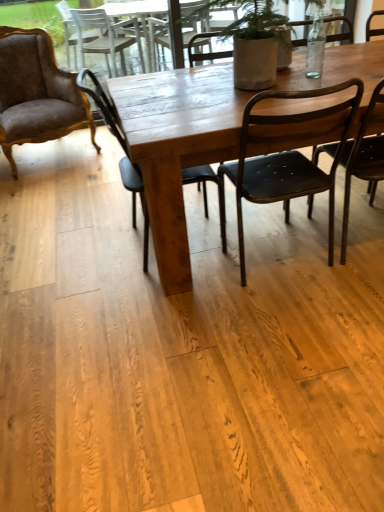
You are a GUI agent. You are given a task and a screenshot of the screen. Output one action in this format:
    pyautogui.click(x=<x>, y=<y>)
    Task: Click on the black metal chair at right, arranged as the fourth chair when viewed from the left
    
    Given the screenshot: What is the action you would take?
    pyautogui.click(x=364, y=157)

This screenshot has width=384, height=512. Describe the element at coordinates (177, 146) in the screenshot. I see `wooden table at center` at that location.

Locate an element on the screen. velvet brown armchair at left, arranged as the 4th chair when viewed from the right is located at coordinates (37, 93).

Measure the distance between point (266, 202) and camera.

They are 5.99 feet apart.

Where is `matte black chair at center, positioned as the 2th chair in left-to-right order`? This screenshot has width=384, height=512. matte black chair at center, positioned as the 2th chair in left-to-right order is located at coordinates (123, 150).

Locate an element on the screen. This screenshot has width=384, height=512. black metal chair at right, which is counted as the 1th chair, starting from the right is located at coordinates (364, 157).

In order to click on chair above the black metal chair at center, the third chair in the left-to-right sequence (from a real-world perspective) in this screenshot , I will do `click(364, 157)`.

Which of these two, black metal chair at right, arranged as the fourth chair when viewed from the left, or black metal chair at center, which is the second chair in right-to-left order, is smaller?

black metal chair at right, arranged as the fourth chair when viewed from the left.

Is black metal chair at right, which is counted as the 1th chair, starting from the right, with black metal chair at center, which is the second chair in right-to-left order?

They are not placed beside each other.

Is black metal chair at center, which is the second chair in right-to-left order, inside black metal chair at right, which is counted as the 1th chair, starting from the right?

No, black metal chair at center, which is the second chair in right-to-left order, is not inside black metal chair at right, which is counted as the 1th chair, starting from the right.

At what (x,y) coordinates should I click in order to perform the action: click on kitchen & dining room table lying on the right of velvet brown armchair at left, arranged as the 4th chair when viewed from the right. Please return your answer as a coordinate pair (x, y). Looking at the image, I should click on (177, 146).

Measure the distance from wooden table at center to velvet brown armchair at left, placed as the 1th chair when sorted from left to right.

A distance of 1.44 meters exists between wooden table at center and velvet brown armchair at left, placed as the 1th chair when sorted from left to right.

From the image's perspective, is wooden table at center located above or below velvet brown armchair at left, arranged as the 4th chair when viewed from the right?

wooden table at center is below velvet brown armchair at left, arranged as the 4th chair when viewed from the right.

Which is more to the right, wooden table at center or velvet brown armchair at left, placed as the 1th chair when sorted from left to right?

From the viewer's perspective, wooden table at center appears more on the right side.

Considering the relative sizes of black metal chair at center, which is the second chair in right-to-left order, and velvet brown armchair at left, placed as the 1th chair when sorted from left to right, in the image provided, is black metal chair at center, which is the second chair in right-to-left order, wider than velvet brown armchair at left, placed as the 1th chair when sorted from left to right,?

No.

Does black metal chair at center, which is the second chair in right-to-left order, contain velvet brown armchair at left, placed as the 1th chair when sorted from left to right?

No, black metal chair at center, which is the second chair in right-to-left order, does not contain velvet brown armchair at left, placed as the 1th chair when sorted from left to right.

Consider the image. Considering the positions of objects black metal chair at center, the third chair in the left-to-right sequence, and velvet brown armchair at left, placed as the 1th chair when sorted from left to right, in the image provided, who is more to the right, black metal chair at center, the third chair in the left-to-right sequence, or velvet brown armchair at left, placed as the 1th chair when sorted from left to right,?

Positioned to the right is black metal chair at center, the third chair in the left-to-right sequence.

Is black metal chair at center, which is the second chair in right-to-left order, oriented away from velvet brown armchair at left, placed as the 1th chair when sorted from left to right?

black metal chair at center, which is the second chair in right-to-left order, does not have its back to velvet brown armchair at left, placed as the 1th chair when sorted from left to right.

Between wooden table at center and black metal chair at center, which is the second chair in right-to-left order, which one appears on the left side from the viewer's perspective?

black metal chair at center, which is the second chair in right-to-left order, is more to the left.

Which of these two, wooden table at center or black metal chair at center, the third chair in the left-to-right sequence, stands taller?

With more height is black metal chair at center, the third chair in the left-to-right sequence.

Is wooden table at center thinner than black metal chair at center, the third chair in the left-to-right sequence?

Incorrect, the width of wooden table at center is not less than that of black metal chair at center, the third chair in the left-to-right sequence.

Is wooden table at center in front of black metal chair at center, which is the second chair in right-to-left order?

No, it is not.

Who is shorter, wooden table at center or matte black chair at center, positioned as the 2th chair in left-to-right order?

With less height is wooden table at center.

From the image's perspective, which one is positioned higher, wooden table at center or matte black chair at center, positioned as the 2th chair in left-to-right order?

wooden table at center appears higher in the image.

Looking at this image, based on their sizes in the image, would you say wooden table at center is bigger or smaller than matte black chair at center, positioned as the 2th chair in left-to-right order?

wooden table at center is bigger than matte black chair at center, positioned as the 2th chair in left-to-right order.

Which is farther from the camera, (151, 181) or (117, 116)?

Positioned behind is point (151, 181).

From a real-world perspective, is black metal chair at right, which is counted as the 1th chair, starting from the right, over velvet brown armchair at left, placed as the 1th chair when sorted from left to right?

Correct, in the physical world, black metal chair at right, which is counted as the 1th chair, starting from the right, is higher than velvet brown armchair at left, placed as the 1th chair when sorted from left to right.

Is black metal chair at right, arranged as the fourth chair when viewed from the left, behind velvet brown armchair at left, arranged as the 4th chair when viewed from the right?

No, it is in front of velvet brown armchair at left, arranged as the 4th chair when viewed from the right.

Which point is more distant from viewer, (378, 150) or (20, 101)?

The point (20, 101) is farther from the camera.

Which object is thinner, black metal chair at right, arranged as the fourth chair when viewed from the left, or velvet brown armchair at left, arranged as the 4th chair when viewed from the right?

black metal chair at right, arranged as the fourth chair when viewed from the left, is thinner.

How far apart are matte black chair at center, the 3th chair viewed from the right, and wooden table at center?

They are 9.71 inches apart.

Is matte black chair at center, positioned as the 2th chair in left-to-right order, surrounding wooden table at center?

No, matte black chair at center, positioned as the 2th chair in left-to-right order, does not contain wooden table at center.

From the picture: In the image, is matte black chair at center, the 3th chair viewed from the right, positioned in front of or behind wooden table at center?

Clearly, matte black chair at center, the 3th chair viewed from the right, is behind wooden table at center.

Is point (215, 174) closer or farther from the camera than point (184, 236)?

Point (215, 174) is closer to the camera than point (184, 236).

Starting from the black metal chair at right, arranged as the fourth chair when viewed from the left, which chair is the 1st one to the left? Please provide its 2D coordinates.

[(287, 154)]

From a real-world perspective, starting from the wooden table at center, which chair is the 2nd one vertically above it? Please provide its 2D coordinates.

[(37, 93)]

Based on the photo, considering their positions, is black metal chair at center, which is the second chair in right-to-left order, positioned closer to velvet brown armchair at left, placed as the 1th chair when sorted from left to right, than black metal chair at right, arranged as the fourth chair when viewed from the left?

Among the two, black metal chair at center, which is the second chair in right-to-left order, is located nearer to velvet brown armchair at left, placed as the 1th chair when sorted from left to right.

Estimate the real-world distances between objects in this image. Which object is closer to velvet brown armchair at left, placed as the 1th chair when sorted from left to right, black metal chair at right, arranged as the fourth chair when viewed from the left, or matte black chair at center, positioned as the 2th chair in left-to-right order?

Among the two, matte black chair at center, positioned as the 2th chair in left-to-right order, is located nearer to velvet brown armchair at left, placed as the 1th chair when sorted from left to right.

Estimate the real-world distances between objects in this image. Which object is closer to matte black chair at center, the 3th chair viewed from the right, black metal chair at center, the third chair in the left-to-right sequence, or velvet brown armchair at left, arranged as the 4th chair when viewed from the right?

black metal chair at center, the third chair in the left-to-right sequence, is positioned closer to the anchor matte black chair at center, the 3th chair viewed from the right.

Looking at the image, which one is located closer to velvet brown armchair at left, arranged as the 4th chair when viewed from the right, matte black chair at center, positioned as the 2th chair in left-to-right order, or wooden table at center?

matte black chair at center, positioned as the 2th chair in left-to-right order.

Based on their spatial positions, is velvet brown armchair at left, arranged as the 4th chair when viewed from the right, or wooden table at center further from matte black chair at center, the 3th chair viewed from the right?

Among the two, velvet brown armchair at left, arranged as the 4th chair when viewed from the right, is located further to matte black chair at center, the 3th chair viewed from the right.

Looking at the image, which one is located further to black metal chair at right, arranged as the fourth chair when viewed from the left, velvet brown armchair at left, arranged as the 4th chair when viewed from the right, or black metal chair at center, the third chair in the left-to-right sequence?

velvet brown armchair at left, arranged as the 4th chair when viewed from the right, is further to black metal chair at right, arranged as the fourth chair when viewed from the left.

From the image, which object appears to be nearer to black metal chair at right, which is counted as the 1th chair, starting from the right, matte black chair at center, positioned as the 2th chair in left-to-right order, or black metal chair at center, which is the second chair in right-to-left order?

black metal chair at center, which is the second chair in right-to-left order, is positioned closer to the anchor black metal chair at right, which is counted as the 1th chair, starting from the right.

Estimate the real-world distances between objects in this image. Which object is further from wooden table at center, matte black chair at center, positioned as the 2th chair in left-to-right order, or black metal chair at center, which is the second chair in right-to-left order?

Based on the image, black metal chair at center, which is the second chair in right-to-left order, appears to be further to wooden table at center.

Where is `chair between velvet brown armchair at left, arranged as the 4th chair when viewed from the right, and black metal chair at center, the third chair in the left-to-right sequence`? The image size is (384, 512). chair between velvet brown armchair at left, arranged as the 4th chair when viewed from the right, and black metal chair at center, the third chair in the left-to-right sequence is located at coordinates (123, 150).

You are a GUI agent. You are given a task and a screenshot of the screen. Output one action in this format:
    pyautogui.click(x=<x>, y=<y>)
    Task: Click on the kitchen & dining room table between matte black chair at center, positioned as the 2th chair in left-to-right order, and black metal chair at right, which is counted as the 1th chair, starting from the right, in the horizontal direction
    Image resolution: width=384 pixels, height=512 pixels.
    Given the screenshot: What is the action you would take?
    pyautogui.click(x=177, y=146)

Where is `chair between matte black chair at center, the 3th chair viewed from the right, and black metal chair at right, arranged as the fourth chair when viewed from the left, in the horizontal direction`? This screenshot has height=512, width=384. chair between matte black chair at center, the 3th chair viewed from the right, and black metal chair at right, arranged as the fourth chair when viewed from the left, in the horizontal direction is located at coordinates tap(287, 154).

Identify the location of chair situated between matte black chair at center, positioned as the 2th chair in left-to-right order, and wooden table at center from left to right. The width and height of the screenshot is (384, 512). (287, 154).